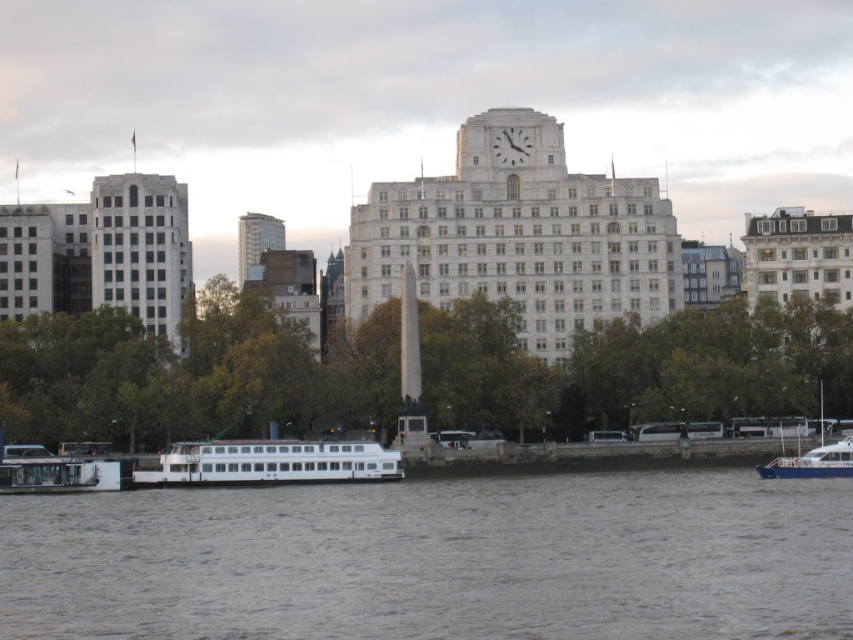
Who is lower down, white glossy boat at center or white glossy boat at lower right?

white glossy boat at lower right is lower down.

Does white glossy boat at center have a greater width compared to white glossy boat at lower right?

Yes, white glossy boat at center is wider than white glossy boat at lower right.

Which is in front, point (224, 476) or point (788, 474)?

Point (224, 476) is more forward.

Where is `white glossy boat at center`? white glossy boat at center is located at coordinates pyautogui.click(x=270, y=464).

Between point (199, 429) and point (782, 458), which one is positioned behind?

Positioned behind is point (199, 429).

Is green leafy tree at center shorter than white glossy boat at lower right?

No, green leafy tree at center is not shorter than white glossy boat at lower right.

Is point (515, 422) closer to viewer compared to point (839, 449)?

No.

I want to click on green leafy tree at center, so click(190, 376).

Can you confirm if gray water at lower center is wider than white glossy boat at lower left?

Yes.

Consider the image. Who is more distant from viewer, (0, 540) or (39, 467)?

Positioned behind is point (39, 467).

Locate an element on the screen. This screenshot has height=640, width=853. gray water at lower center is located at coordinates click(x=437, y=557).